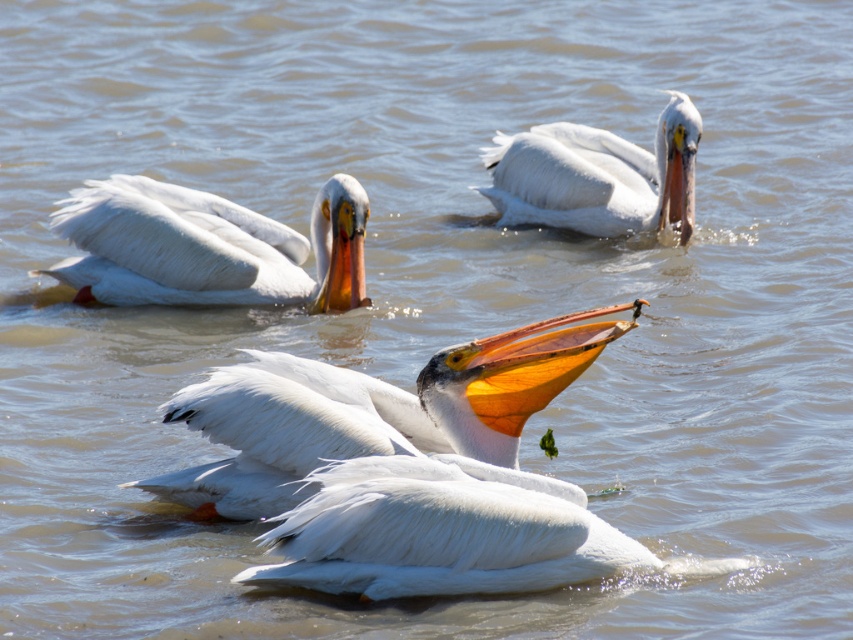
Based on the coordinates provided, where is the white feathered pelican at center located in the image?

Result: The white feathered pelican at center is located at the coordinates point (439,531).

You are observing two pelicans in the water. The white matte pelican at center and the white feathered pelican at center. Which one is positioned higher in the image?

The white matte pelican at center is positioned higher in the image than the white feathered pelican at center.